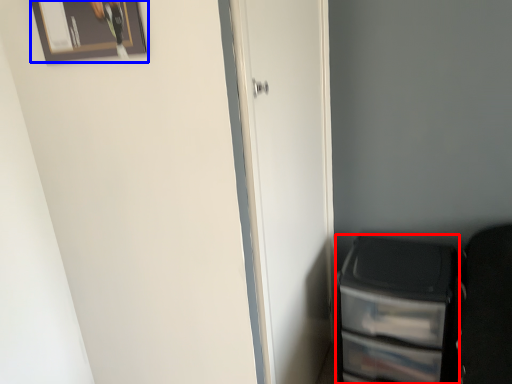
Question: Which object is closer to the camera taking this photo, file cabinet (highlighted by a red box) or picture frame (highlighted by a blue box)?

Choices:
 (A) file cabinet
 (B) picture frame

Answer: (B)